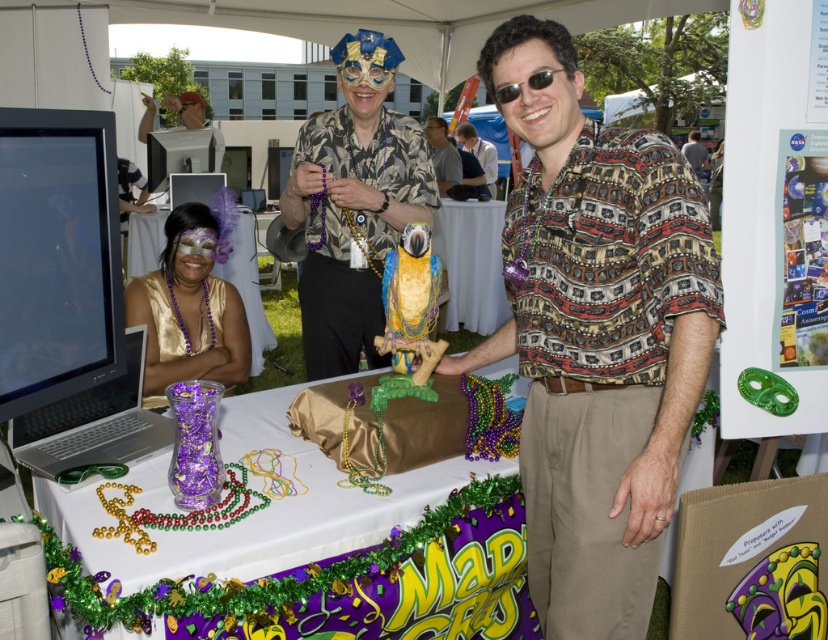
You are a guest at this Mardi Gras event and want to place your sunglasses somewhere safe. The table has a white fabric tablecloth at center and sunglasses at center. Based on their sizes, which object can you use to cover your sunglasses to protect them?

The white fabric tablecloth at center is much taller than the sunglasses at center, so you can use the white fabric tablecloth at center to cover the sunglasses at center effectively.

You are a photographer at the Mardi Gras event and want to take a photo of the sunglasses at center without the matte black mask at upper left blocking it. Is this possible given their current positions?

The sunglasses at center is behind the matte black mask at upper left, so it is blocked by the mask and cannot be seen without moving either object.

You are at a Mardi Gras event and need to place a 15 feet long banner between the patterned shirt at center and the sunglasses at center. Is there enough space?

The patterned shirt at center is 17.80 feet from the sunglasses at center, so yes, there is enough space to place a 15 feet long banner between them since the distance is greater than the banner length.